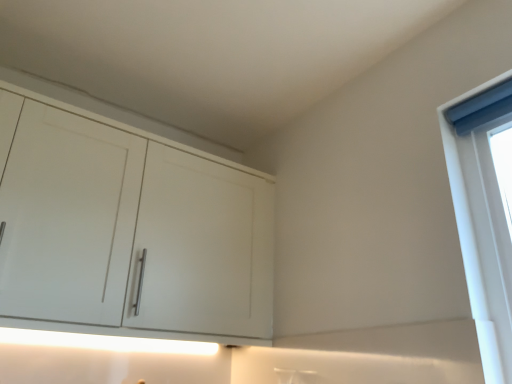
What is the approximate height of white matte cabinet at upper left?

31.55 inches.

Describe the element at coordinates (128, 227) in the screenshot. The image size is (512, 384). I see `white matte cabinet at upper left` at that location.

I want to click on white matte cabinet at upper left, so click(128, 227).

The width and height of the screenshot is (512, 384). In order to click on white matte cabinet at upper left in this screenshot , I will do `click(128, 227)`.